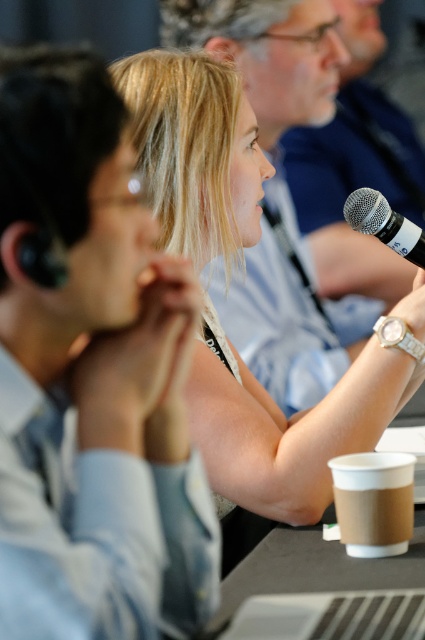
Which is above, brown paper cup at lower right or silver metallic microphone at upper right?

silver metallic microphone at upper right is higher up.

Measure the distance between brown paper cup at lower right and silver metallic microphone at upper right.

The distance of brown paper cup at lower right from silver metallic microphone at upper right is 21.13 inches.

Locate an element on the screen. brown paper cup at lower right is located at coordinates (374, 500).

The height and width of the screenshot is (640, 425). What do you see at coordinates (286, 426) in the screenshot?
I see `smooth skin woman at center` at bounding box center [286, 426].

Between smooth skin woman at center and silver metallic microphone at upper right, which one is positioned lower?

smooth skin woman at center is below.

Locate an element on the screen. This screenshot has width=425, height=640. smooth skin woman at center is located at coordinates tap(286, 426).

Where is `smooth skin woman at center`? This screenshot has width=425, height=640. smooth skin woman at center is located at coordinates (286, 426).

Does smooth skin woman at center appear over brown paper cup at lower right?

Yes, smooth skin woman at center is above brown paper cup at lower right.

Who is taller, smooth skin woman at center or brown paper cup at lower right?

With more height is smooth skin woman at center.

Is point (221, 125) farther from camera compared to point (348, 472)?

Yes, point (221, 125) is farther from viewer.

Find the location of a particular element. smooth skin woman at center is located at coordinates (286, 426).